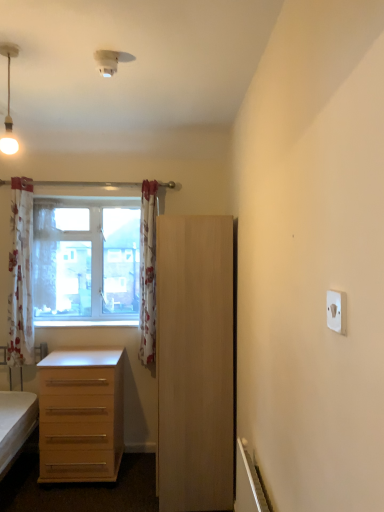
Find the location of a particular element. This screenshot has width=384, height=512. vacant space situated above white glossy window sill at lower center (from a real-world perspective) is located at coordinates pyautogui.click(x=84, y=323).